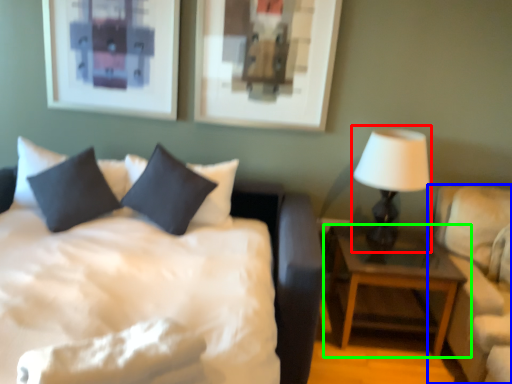
Question: Which object is the farthest from table lamp (highlighted by a red box)? Choose among these: studio couch (highlighted by a blue box) or nightstand (highlighted by a green box).

Choices:
 (A) studio couch
 (B) nightstand

Answer: (B)